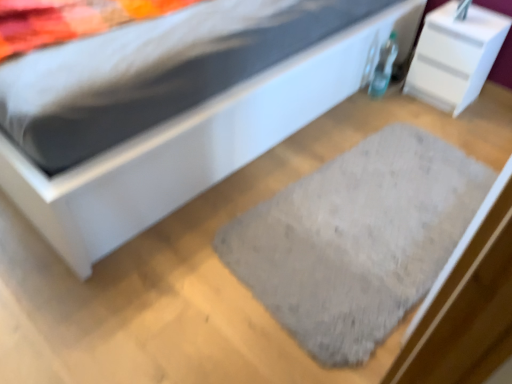
Locate an element on the screen. The image size is (512, 384). vacant space to the left of gray fuzzy rug at center is located at coordinates (164, 264).